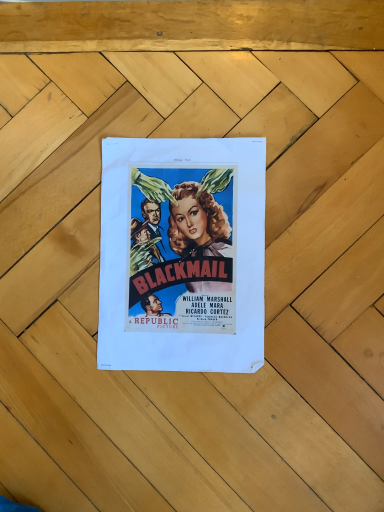
Locate an element on the screen. The height and width of the screenshot is (512, 384). vacant point above matte paper poster at center (from a real-world perspective) is located at coordinates (168, 261).